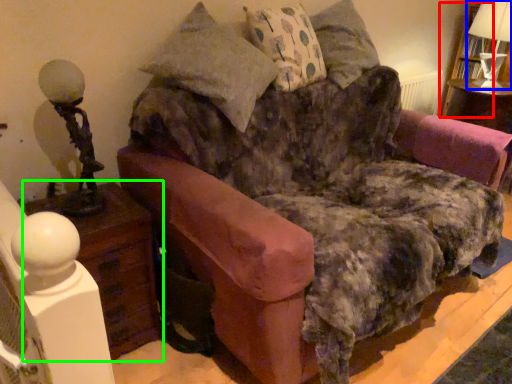
Question: Which is farther away from bookshelf (highlighted by a red box)? table lamp (highlighted by a blue box) or nightstand (highlighted by a green box)?

Choices:
 (A) table lamp
 (B) nightstand

Answer: (B)